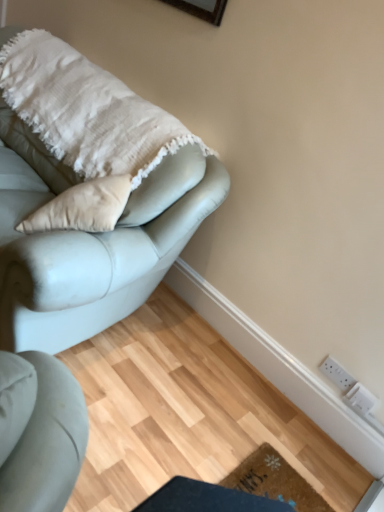
Question: From a real-world perspective, is brown textured mat at lower center below white plastic electric outlet at lower right, arranged as the 1th electric outlet when ordered from the bottom?

Choices:
 (A) yes
 (B) no

Answer: (A)

Question: From the image's perspective, is brown textured mat at lower center located beneath white plastic electric outlet at lower right, arranged as the 1th electric outlet when ordered from the bottom?

Choices:
 (A) no
 (B) yes

Answer: (B)

Question: Is brown textured mat at lower center smaller than white plastic electric outlet at lower right, placed as the 2th electric outlet when sorted from top to bottom?

Choices:
 (A) yes
 (B) no

Answer: (B)

Question: Does brown textured mat at lower center lie behind white plastic electric outlet at lower right, arranged as the 1th electric outlet when ordered from the bottom?

Choices:
 (A) no
 (B) yes

Answer: (A)

Question: Could you tell me if brown textured mat at lower center is facing white plastic electric outlet at lower right, arranged as the 1th electric outlet when ordered from the bottom?

Choices:
 (A) no
 (B) yes

Answer: (A)

Question: Considering their positions, is white plastic electric outlet at lower right, arranged as the 1th electric outlet when ordered from the bottom, located in front of or behind satin light blue couch at upper left?

Choices:
 (A) front
 (B) behind

Answer: (B)

Question: In terms of width, does white plastic electric outlet at lower right, placed as the 2th electric outlet when sorted from top to bottom, look wider or thinner when compared to satin light blue couch at upper left?

Choices:
 (A) wide
 (B) thin

Answer: (B)

Question: In the image, is white plastic electric outlet at lower right, arranged as the 1th electric outlet when ordered from the bottom, on the left side or the right side of satin light blue couch at upper left?

Choices:
 (A) left
 (B) right

Answer: (B)

Question: Is white plastic electric outlet at lower right, arranged as the 1th electric outlet when ordered from the bottom, bigger or smaller than satin light blue couch at upper left?

Choices:
 (A) small
 (B) big

Answer: (A)

Question: From a real-world perspective, is white plastic electric outlet at lower right, arranged as the 1th electric outlet when ordered from the bottom, physically located above or below brown textured mat at lower center?

Choices:
 (A) above
 (B) below

Answer: (A)

Question: Relative to brown textured mat at lower center, is white plastic electric outlet at lower right, arranged as the 1th electric outlet when ordered from the bottom, in front or behind?

Choices:
 (A) front
 (B) behind

Answer: (B)

Question: Looking at the image, does white plastic electric outlet at lower right, arranged as the 1th electric outlet when ordered from the bottom, seem bigger or smaller compared to brown textured mat at lower center?

Choices:
 (A) small
 (B) big

Answer: (A)

Question: Does point (365, 393) appear closer or farther from the camera than point (266, 475)?

Choices:
 (A) closer
 (B) farther

Answer: (B)

Question: In the image, is brown textured mat at lower center positioned in front of or behind white textured blanket at upper left?

Choices:
 (A) front
 (B) behind

Answer: (A)

Question: Is point [226, 484] positioned closer to the camera than point [61, 54]?

Choices:
 (A) farther
 (B) closer

Answer: (B)